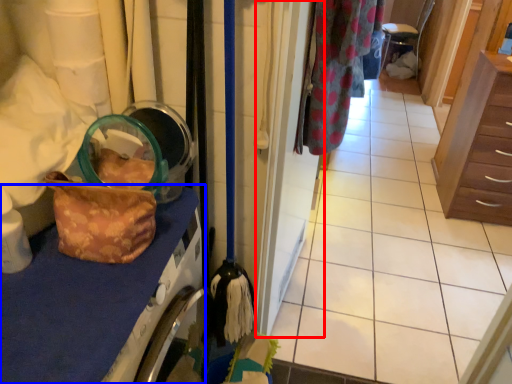
Question: Which object is further to the camera taking this photo, door (highlighted by a red box) or counter top (highlighted by a blue box)?

Choices:
 (A) door
 (B) counter top

Answer: (A)